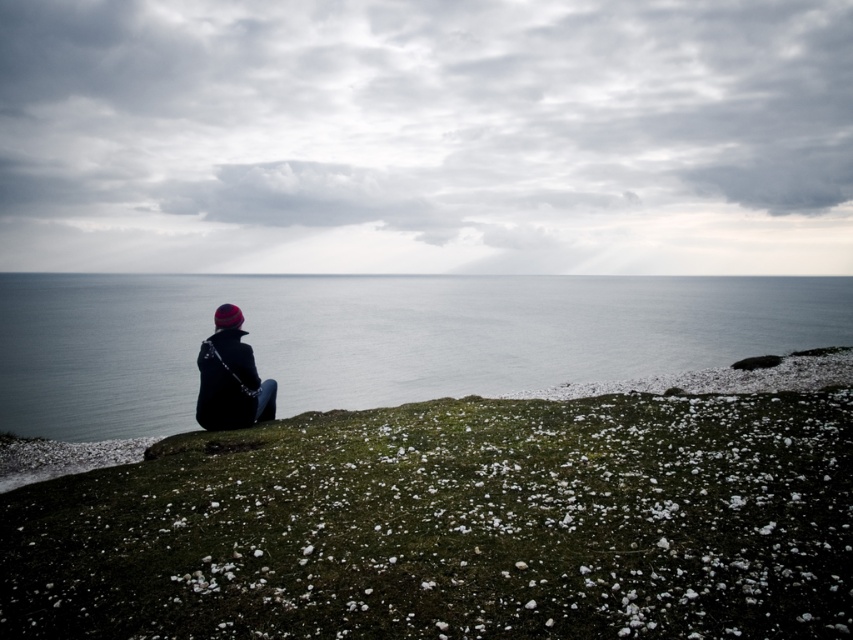
You are standing at the edge of the cliff in the coastal scene. You want to place a small flag exactly where the green mossy grass at center is located. Given that the flag is 0.3 meters wide, can you determine if the area at point (456, 525) is wide enough to accommodate the flag without overlapping any nearby objects?

The green mossy grass at center is represented by point (456, 525). Since the point indicates the location of the grass, and there is no mention of nearby objects in the provided description, it is safe to assume the area is wide enough to place the flag without overlapping.

You are a photographer trying to capture the person in the scene. You want to ensure the dark blue fabric jacket at center and the green mossy grass at center are both visible in your shot. Which object should you adjust your camera angle to focus on first to include both?

The green mossy grass at center is to the right of the dark blue fabric jacket at center. To include both in the shot, focus on the dark blue fabric jacket at center first as it is to the left, then adjust the angle to include the grass on the right.